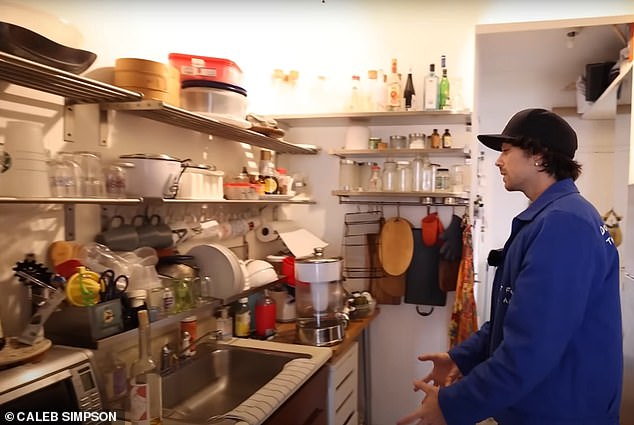
Locate an element on the screen. Image resolution: width=634 pixels, height=425 pixels. juicer is located at coordinates (73, 290).